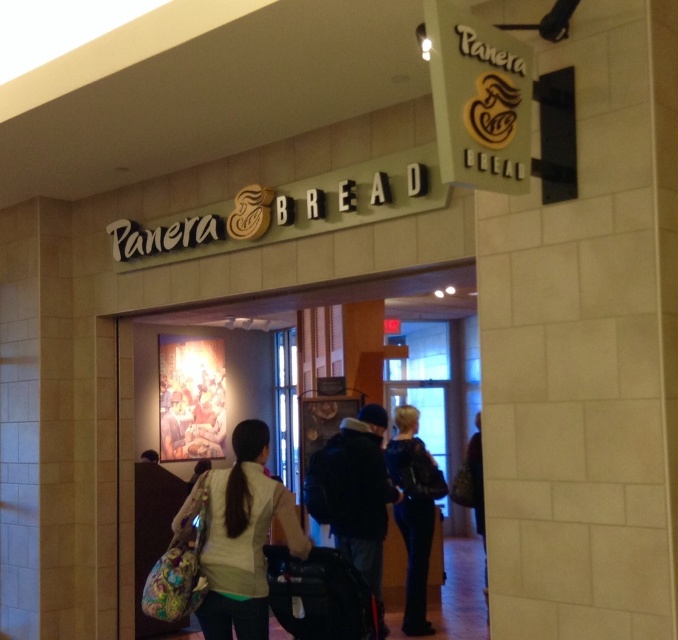
You are standing at the entrance of the Panera Bread restaurant and see a white fabric backpack at center and a leather jacket at center. Which one is positioned to the left?

The white fabric backpack at center is positioned to the left of the leather jacket at center.

You are a customer entering the Panera Bread restaurant and see a white fabric backpack at center and a leather jacket at center. Which item is placed higher on the coat rack?

The white fabric backpack at center is positioned over the leather jacket at center, so it is placed higher on the coat rack.